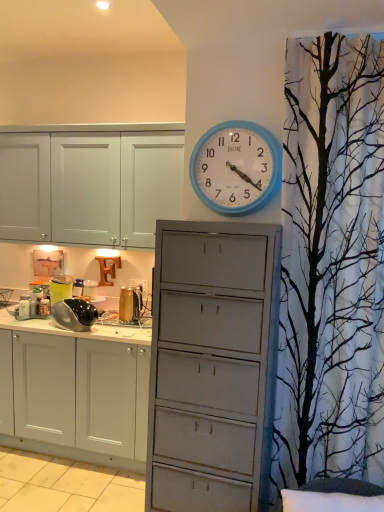
At what (x,y) coordinates should I click in order to perform the action: click on free point behind gold metallic kettle at center, placed as the 3th appliance when sorted from left to right. Please return your answer as a coordinate pair (x, y). Looking at the image, I should click on (x=127, y=321).